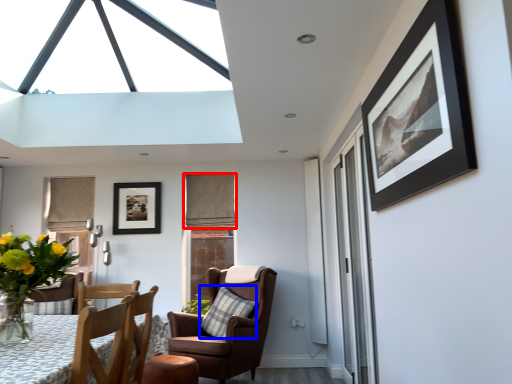
Question: Which of the following is the closest to the observer, curtain (highlighted by a red box) or pillow (highlighted by a blue box)?

Choices:
 (A) curtain
 (B) pillow

Answer: (B)